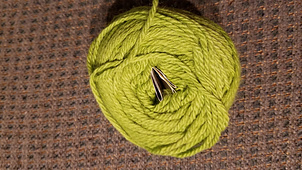
Where is `corner`? The height and width of the screenshot is (170, 302). corner is located at coordinates (300, 169).